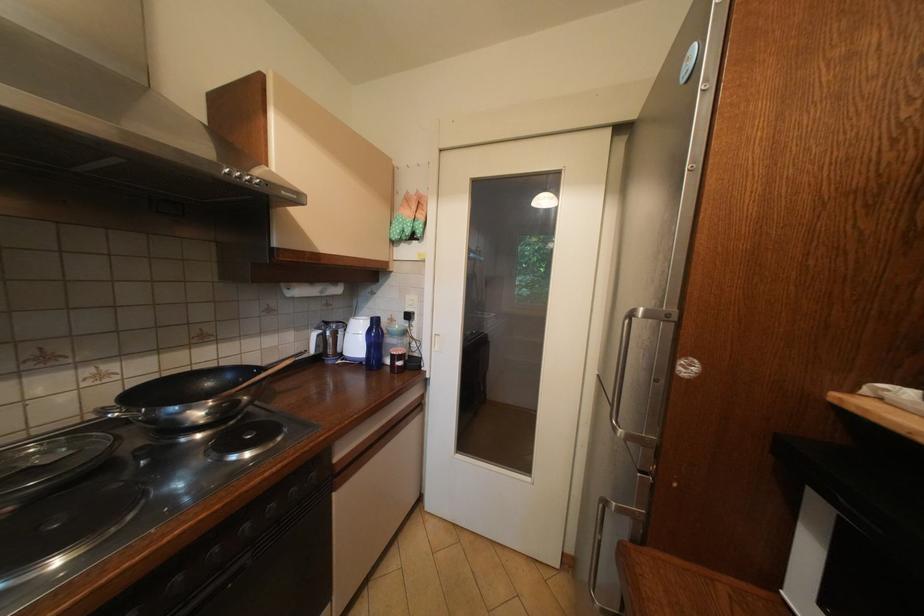
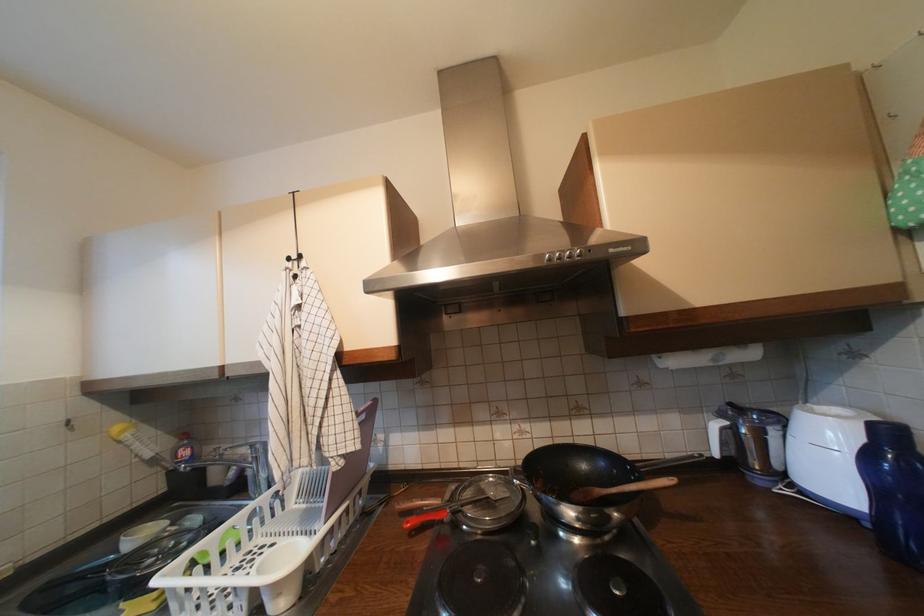
The point at (256, 182) is marked in the first image. Where is the corresponding point in the second image?

(577, 257)